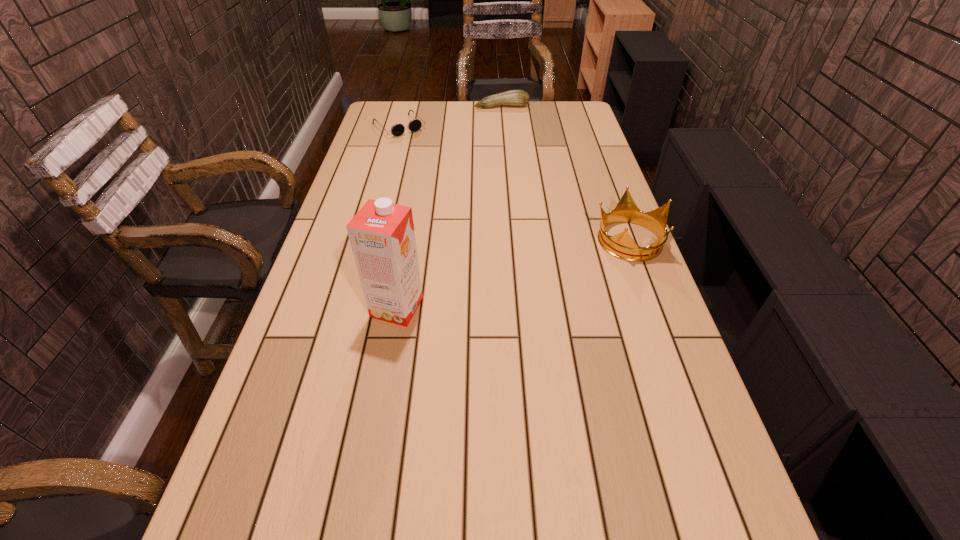
This screenshot has height=540, width=960. I want to click on free space located on the front-facing side of the shortest object, so click(443, 170).

The height and width of the screenshot is (540, 960). I want to click on free space located on the front-facing side of the shortest object, so click(x=422, y=150).

The height and width of the screenshot is (540, 960). Identify the location of free region located on the front-facing side of the shortest object. (442, 168).

Where is `vacant space located 0.360m at the stem end of the second object from right to left`? The image size is (960, 540). vacant space located 0.360m at the stem end of the second object from right to left is located at coordinates (520, 152).

Where is `vacant area situated at the stem end of the second object from right to left`? vacant area situated at the stem end of the second object from right to left is located at coordinates (512, 128).

You are a GUI agent. You are given a task and a screenshot of the screen. Output one action in this format:
    pyautogui.click(x=<x>, y=<y>)
    Task: Click on the vacant space located at the stem end of the second object from right to left
    This screenshot has width=960, height=540.
    Given the screenshot: What is the action you would take?
    pyautogui.click(x=515, y=137)

You are a GUI agent. You are given a task and a screenshot of the screen. Output one action in this format:
    pyautogui.click(x=<x>, y=<y>)
    Task: Click on the sunglasses located in the far edge section of the desktop
    
    Given the screenshot: What is the action you would take?
    pyautogui.click(x=414, y=125)

The image size is (960, 540). I want to click on zucchini located at the far edge, so [x=518, y=98].

The image size is (960, 540). Identify the location of object that is at the left edge. [414, 125].

Where is `object that is at the right edge`? This screenshot has width=960, height=540. object that is at the right edge is located at coordinates (622, 246).